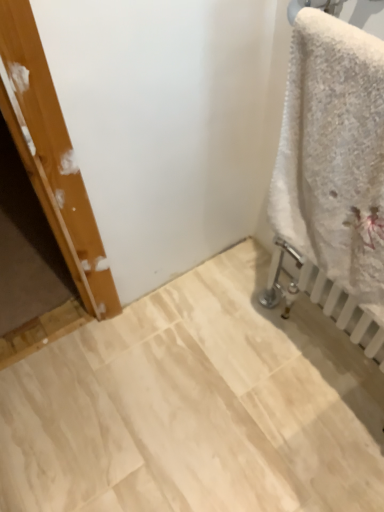
Locate an element on the screen. Image resolution: width=384 pixels, height=512 pixels. white fluffy towel at right is located at coordinates (333, 153).

What do you see at coordinates (333, 153) in the screenshot? The height and width of the screenshot is (512, 384). I see `white fluffy towel at right` at bounding box center [333, 153].

Locate an element on the screen. This screenshot has height=512, width=384. white fluffy towel at right is located at coordinates (333, 153).